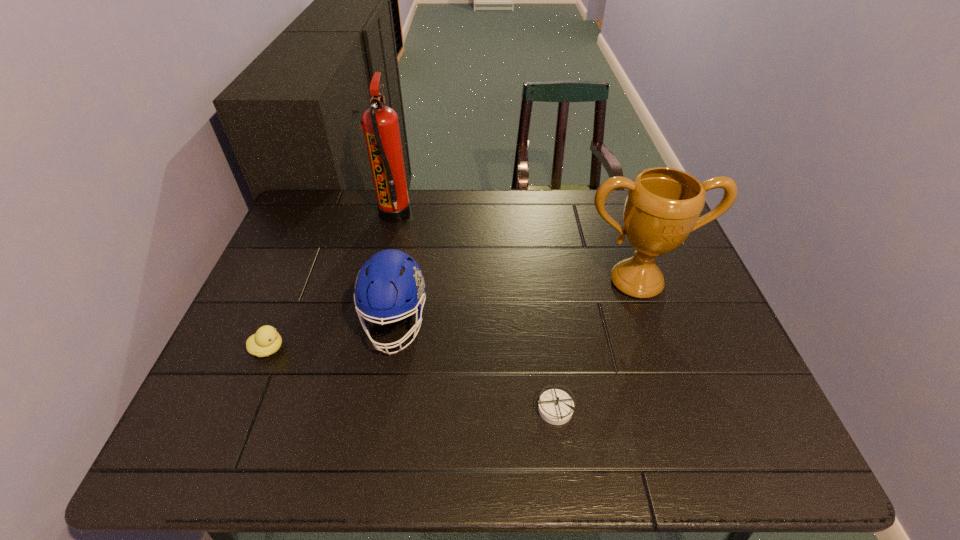
This screenshot has width=960, height=540. I want to click on vacant space that's between the third shortest object and the fourth shortest object, so click(516, 302).

At what (x,y) coordinates should I click in order to perform the action: click on free spot between the fire extinguisher and the award. Please return your answer as a coordinate pair (x, y). This screenshot has height=540, width=960. Looking at the image, I should click on (516, 248).

Find the location of a particular element. This screenshot has width=960, height=540. free point between the tallest object and the compass is located at coordinates (474, 312).

The image size is (960, 540). In order to click on empty space that is in between the third tallest object and the leftmost object in this screenshot , I will do `click(332, 336)`.

Locate which object ranks fourth in proximity to the third tallest object. Please provide its 2D coordinates. Your answer should be formatted as a tuple, i.e. [(x, y)], where the tuple contains the x and y coordinates of a point satisfying the conditions above.

[(663, 205)]

I want to click on object that can be found as the second closest to the fire extinguisher, so click(266, 341).

Where is `vacant space that satisfies the following two spatial constraints: 1. at the beak of the duckling; 2. on the right side of the nearest object`? This screenshot has height=540, width=960. vacant space that satisfies the following two spatial constraints: 1. at the beak of the duckling; 2. on the right side of the nearest object is located at coordinates (244, 409).

Where is `free spot that satisfies the following two spatial constraints: 1. on the face guard of the football helmet; 2. at the beak of the leftmost object`? This screenshot has height=540, width=960. free spot that satisfies the following two spatial constraints: 1. on the face guard of the football helmet; 2. at the beak of the leftmost object is located at coordinates pyautogui.click(x=391, y=349).

The width and height of the screenshot is (960, 540). I want to click on free space that satisfies the following two spatial constraints: 1. on the face guard of the compass; 2. on the left side of the football helmet, so click(380, 409).

Locate an element on the screen. free spot that satisfies the following two spatial constraints: 1. on the face guard of the football helmet; 2. at the beak of the leftmost object is located at coordinates (391, 349).